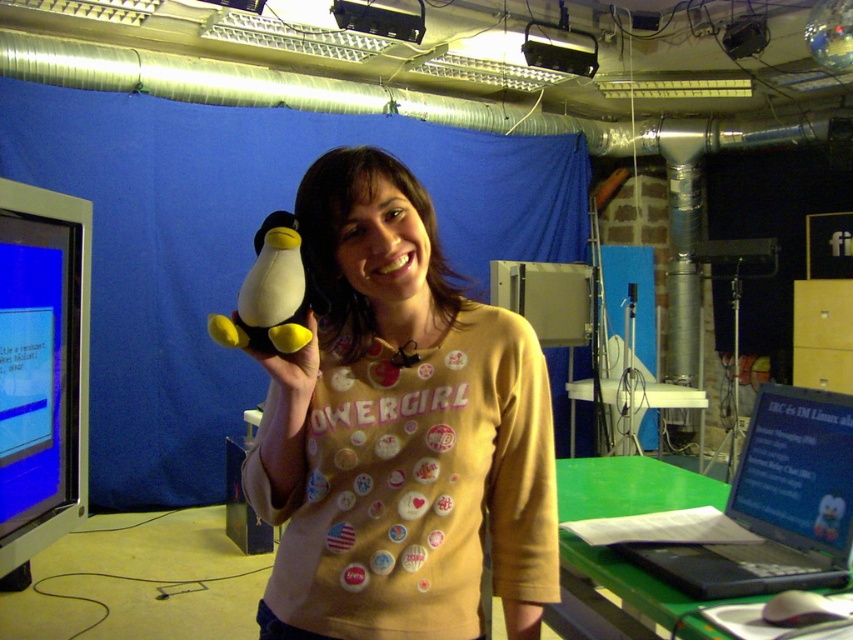
You are a photographer setting up for a live stream. You have two markers at coordinates point [816,506] and point [238,310]. Which marker is positioned further back in the scene?

Point [816,506] is behind point [238,310], so the marker at point [816,506] is positioned further back in the scene.

You are a photographer setting up for a live stream. You need to position a camera so that both the blue fabric backdrop at upper left and the yellow matte plush toy at center are in frame. Given that the camera has a 50mm lens with a field of view of approximately 46 degrees, can you determine if both objects will fit within the camera frame?

The blue fabric backdrop at upper left and yellow matte plush toy at center are 3.43 meters apart from each other. With a 50mm lens providing a 46 degree field of view, the camera can capture objects up to approximately 3.5 meters apart within the frame. Since the distance between the two objects is 3.43 meters, they will fit within the camera frame.